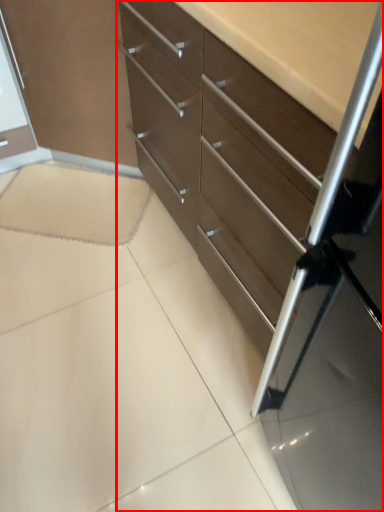
Question: From the image's perspective, what is the correct spatial positioning of chest of drawers (annotated by the red box) in reference to ceramic tile?

Choices:
 (A) above
 (B) below

Answer: (A)